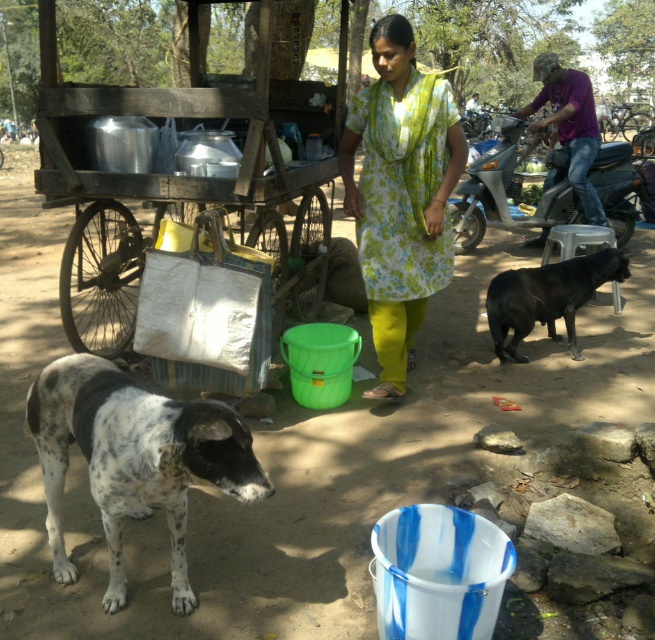
You are a street vendor who needs to move your items from the wooden cart to the metallic silver motorcycle at right. The black smooth dog at right is in the way. Can you lift the dog over the motorcycle to clear the path?

The metallic silver motorcycle at right is much taller than the black smooth dog at right, so lifting the dog over the motorcycle would not be possible since the motorcycle is taller. You need to move the dog aside or find another way around.

Looking at this image, you are standing in the scene and want to place a small flag at the point closer to you between point (504, 148) and point (476, 116). Which point should you choose?

You should choose point (504, 148) because it is closer to the viewer than point (476, 116) according to the description.